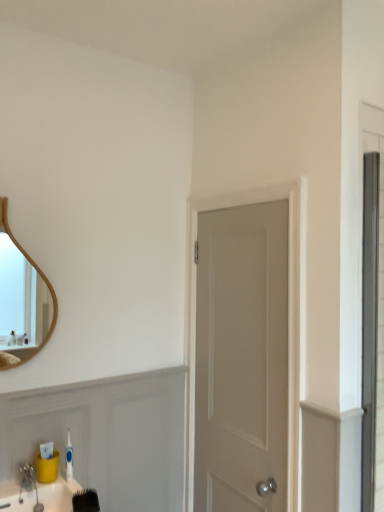
This screenshot has height=512, width=384. What do you see at coordinates (23, 301) in the screenshot? I see `wooden mirror at upper left` at bounding box center [23, 301].

Describe the element at coordinates (288, 319) in the screenshot. I see `white matte door at center` at that location.

The height and width of the screenshot is (512, 384). Describe the element at coordinates (27, 477) in the screenshot. I see `brushed metal faucet at lower left` at that location.

In order to face brushed metal faucet at lower left, should I rotate leftwards or rightwards?

Rotate left and turn 20.792 degrees.

What do you see at coordinates (85, 501) in the screenshot? Image resolution: width=384 pixels, height=512 pixels. I see `black bristle brush at lower left` at bounding box center [85, 501].

Where is `wooden mirror at upper left`? The image size is (384, 512). wooden mirror at upper left is located at coordinates (23, 301).

Considering the relative positions of black bristle brush at lower left and brushed metal faucet at lower left in the image provided, is black bristle brush at lower left to the right of brushed metal faucet at lower left from the viewer's perspective?

Yes.

Looking at this image, is black bristle brush at lower left facing away from brushed metal faucet at lower left?

No.

Is black bristle brush at lower left directly adjacent to brushed metal faucet at lower left?

No, black bristle brush at lower left is not beside brushed metal faucet at lower left.

Considering the relative positions of black bristle brush at lower left and brushed metal faucet at lower left in the image provided, is black bristle brush at lower left behind brushed metal faucet at lower left?

No, black bristle brush at lower left is closer to the viewer.

Which object is positioned more to the right, brushed metal faucet at lower left or black bristle brush at lower left?

black bristle brush at lower left.

Does point (25, 485) come in front of point (80, 499)?

That is True.

Does brushed metal faucet at lower left have a greater height compared to black bristle brush at lower left?

Yes, brushed metal faucet at lower left is taller than black bristle brush at lower left.

From the image's perspective, who appears lower, brushed metal faucet at lower left or black bristle brush at lower left?

black bristle brush at lower left is shown below in the image.

In the image, is black bristle brush at lower left positioned in front of or behind white matte door at center?

In the image, black bristle brush at lower left appears in front of white matte door at center.

Can you confirm if black bristle brush at lower left is positioned to the left of white matte door at center?

Indeed, black bristle brush at lower left is positioned on the left side of white matte door at center.

How many degrees apart are the facing directions of black bristle brush at lower left and white matte door at center?

They differ by 75.7 degrees in their facing directions.

Considering the sizes of white matte door at center and wooden mirror at upper left in the image, is white matte door at center taller or shorter than wooden mirror at upper left?

white matte door at center is taller than wooden mirror at upper left.

Looking at this image, does white matte door at center have a smaller size compared to wooden mirror at upper left?

No.

In the scene shown: Is white matte door at center facing away from wooden mirror at upper left?

white matte door at center does not have its back to wooden mirror at upper left.

Considering the relative positions of white matte door at center and wooden mirror at upper left in the image provided, is white matte door at center to the left or to the right of wooden mirror at upper left?

From the image, it's evident that white matte door at center is to the right of wooden mirror at upper left.

Between wooden mirror at upper left and brushed metal faucet at lower left, which one has larger size?

With larger size is wooden mirror at upper left.

Is point (1, 265) in front of point (30, 483)?

No, (1, 265) is further to viewer.

From the image's perspective, is wooden mirror at upper left located above or below brushed metal faucet at lower left?

wooden mirror at upper left is situated higher than brushed metal faucet at lower left in the image.

Can you tell me how much wooden mirror at upper left and brushed metal faucet at lower left differ in facing direction?

They differ by 0.403 degrees in their facing directions.

Based on the photo, from the image's perspective, relative to black bristle brush at lower left, is wooden mirror at upper left above or below?

wooden mirror at upper left is situated higher than black bristle brush at lower left in the image.

Which object is wider, wooden mirror at upper left or black bristle brush at lower left?

Wider between the two is black bristle brush at lower left.

Which of these two, wooden mirror at upper left or black bristle brush at lower left, stands taller?

Standing taller between the two is wooden mirror at upper left.

Who is bigger, wooden mirror at upper left or black bristle brush at lower left?

With larger size is wooden mirror at upper left.

Is white matte door at center to the left of brushed metal faucet at lower left from the viewer's perspective?

Incorrect, white matte door at center is not on the left side of brushed metal faucet at lower left.

Can you confirm if white matte door at center is smaller than brushed metal faucet at lower left?

No, white matte door at center is not smaller than brushed metal faucet at lower left.

Where is `brush located underneath the brushed metal faucet at lower left (from a real-world perspective)`? Image resolution: width=384 pixels, height=512 pixels. brush located underneath the brushed metal faucet at lower left (from a real-world perspective) is located at coordinates (85, 501).

The width and height of the screenshot is (384, 512). I want to click on faucet located on the left of black bristle brush at lower left, so click(27, 477).

In the scene shown: When comparing their distances from wooden mirror at upper left, does black bristle brush at lower left or white matte door at center seem closer?

black bristle brush at lower left.

In the scene shown: From the image, which object appears to be farther from brushed metal faucet at lower left, white matte door at center or black bristle brush at lower left?

white matte door at center.

From the picture: Looking at the image, which one is located closer to brushed metal faucet at lower left, black bristle brush at lower left or wooden mirror at upper left?

A: black bristle brush at lower left lies closer to brushed metal faucet at lower left than the other object.

Which object lies nearer to the anchor point wooden mirror at upper left, white matte door at center or brushed metal faucet at lower left?

brushed metal faucet at lower left.

Based on their spatial positions, is wooden mirror at upper left or white matte door at center closer to black bristle brush at lower left?

white matte door at center is positioned closer to the anchor black bristle brush at lower left.

Estimate the real-world distances between objects in this image. Which object is closer to wooden mirror at upper left, black bristle brush at lower left or brushed metal faucet at lower left?

Among the two, black bristle brush at lower left is located nearer to wooden mirror at upper left.

Looking at the image, which one is located further to brushed metal faucet at lower left, white matte door at center or wooden mirror at upper left?

Based on the image, wooden mirror at upper left appears to be further to brushed metal faucet at lower left.

Based on the photo, based on their spatial positions, is brushed metal faucet at lower left or white matte door at center further from wooden mirror at upper left?

Based on the image, white matte door at center appears to be further to wooden mirror at upper left.

Identify the location of brush between brushed metal faucet at lower left and white matte door at center from left to right. (85, 501).

This screenshot has height=512, width=384. What are the coordinates of `brush between wooden mirror at upper left and white matte door at center from left to right` in the screenshot? It's located at (85, 501).

At what (x,y) coordinates should I click in order to perform the action: click on faucet between wooden mirror at upper left and black bristle brush at lower left in the up-down direction. Please return your answer as a coordinate pair (x, y). Looking at the image, I should click on (27, 477).

Locate an element on the screen. The width and height of the screenshot is (384, 512). faucet between wooden mirror at upper left and white matte door at center in the horizontal direction is located at coordinates (27, 477).